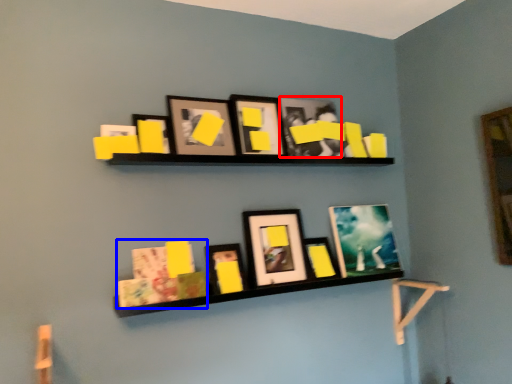
Question: Which point is further to the camera, picture frame (highlighted by a red box) or book (highlighted by a blue box)?

Choices:
 (A) picture frame
 (B) book

Answer: (A)